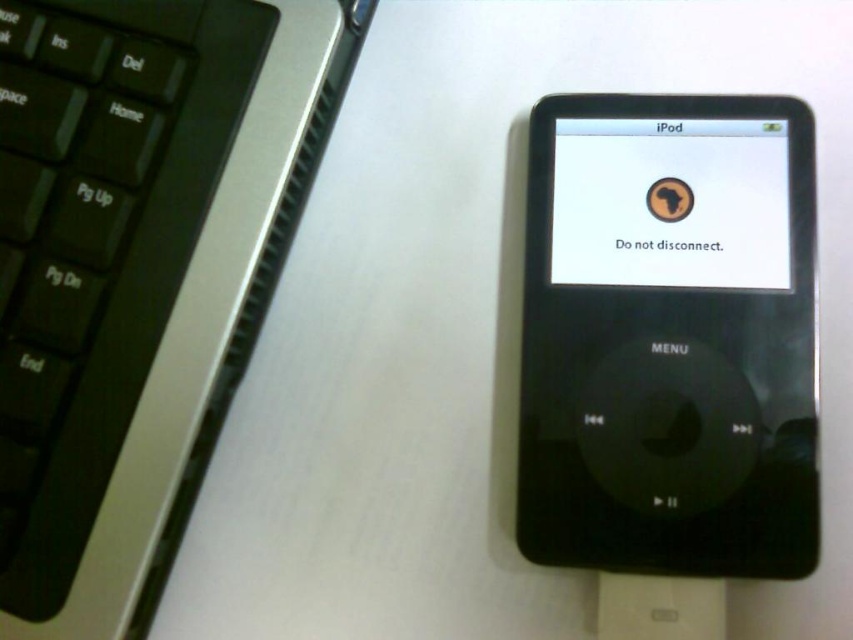
Question: Is black plastic keyboard at upper left smaller than black matte ipod at center?

Choices:
 (A) no
 (B) yes

Answer: (A)

Question: Among these points, which one is nearest to the camera?

Choices:
 (A) (96, 225)
 (B) (619, 320)

Answer: (A)

Question: Which of the following is the farthest from the observer?

Choices:
 (A) (732, 358)
 (B) (347, 20)

Answer: (B)

Question: Does black plastic keyboard at upper left appear under black matte ipod at center?

Choices:
 (A) yes
 (B) no

Answer: (B)

Question: Is black plastic keyboard at upper left bigger than black matte ipod at center?

Choices:
 (A) no
 (B) yes

Answer: (B)